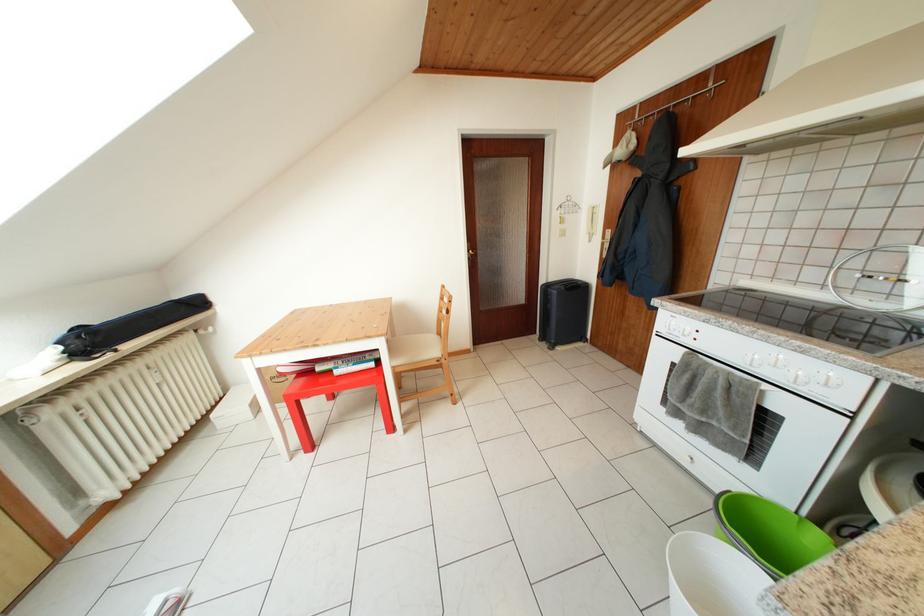
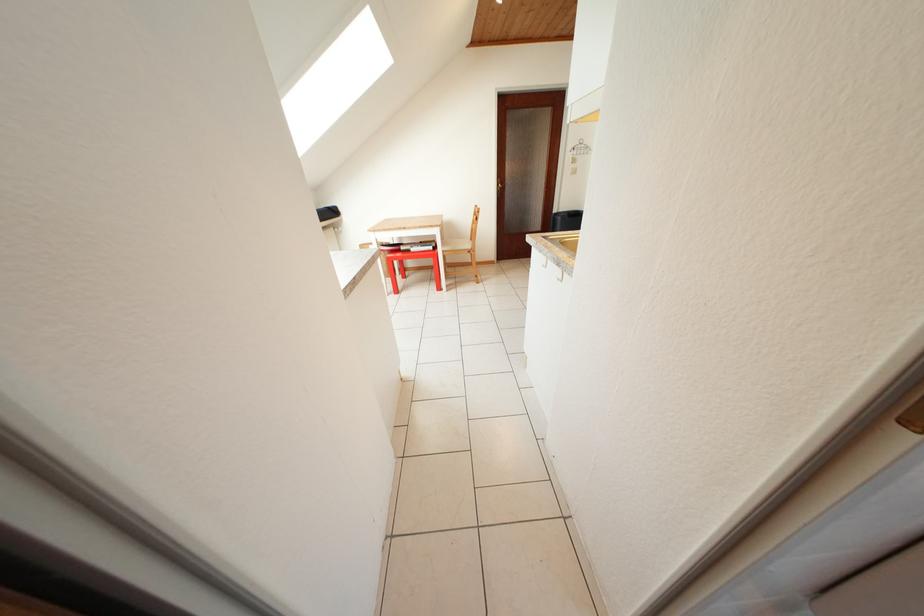
Where in the second image is the point corresponding to [407,368] from the first image?

(454, 254)